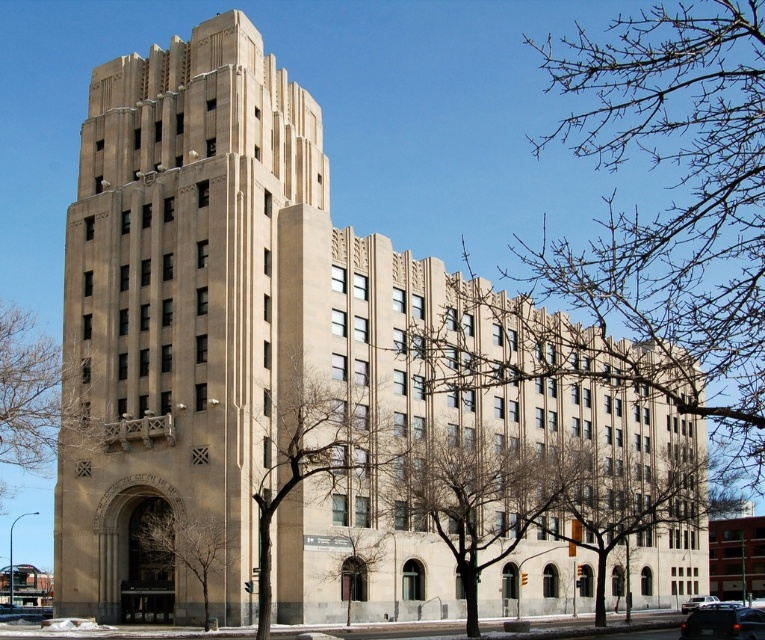
You are standing in front of the beige stone tower at center and want to see the black rubber car at lower right. Which direction should you move to look towards it?

You should move your gaze downward because the beige stone tower at center is above the black rubber car at lower right.

You are standing in front of the building and notice the beige stone tower at center and the metallic silver sedan at center. Which object is taller?

The beige stone tower at center is taller than the metallic silver sedan at center.